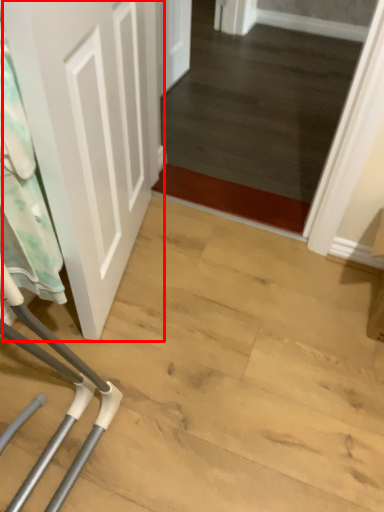
Question: From the image, what is the correct spatial relationship of door (annotated by the red box) in relation to laundry?

Choices:
 (A) left
 (B) right

Answer: (B)